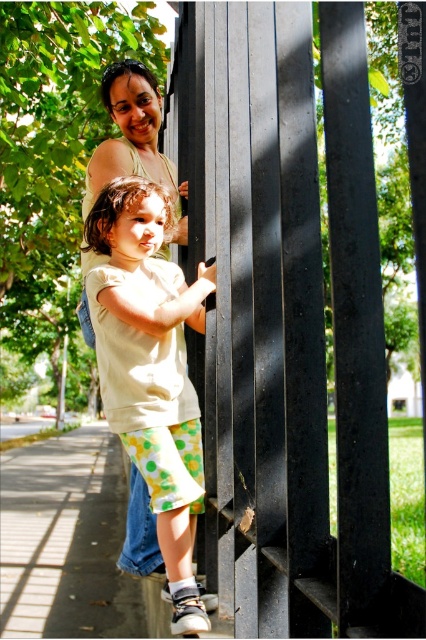
Can you confirm if black matte fence at upper center is bigger than matte green tank top at upper center?

Indeed, black matte fence at upper center has a larger size compared to matte green tank top at upper center.

Which is behind, point (362, 140) or point (100, 145)?

Positioned behind is point (100, 145).

Locate an element on the screen. Image resolution: width=426 pixels, height=640 pixels. black matte fence at upper center is located at coordinates (287, 317).

In the scene shown: Who is more distant from viewer, (x=316, y=470) or (x=111, y=518)?

The point (x=111, y=518) is more distant.

Does black matte fence at upper center lie in front of gray asphalt pavement at lower left?

Yes.

Which is in front, point (198, 61) or point (11, 499)?

Point (198, 61) is more forward.

Where is `black matte fence at upper center`? black matte fence at upper center is located at coordinates (287, 317).

Does gray asphalt pavement at lower left have a greater width compared to matte green tank top at upper center?

Yes.

What do you see at coordinates (66, 540) in the screenshot? I see `gray asphalt pavement at lower left` at bounding box center [66, 540].

What do you see at coordinates (66, 540) in the screenshot?
I see `gray asphalt pavement at lower left` at bounding box center [66, 540].

The height and width of the screenshot is (640, 426). What are the coordinates of `gray asphalt pavement at lower left` in the screenshot? It's located at (66, 540).